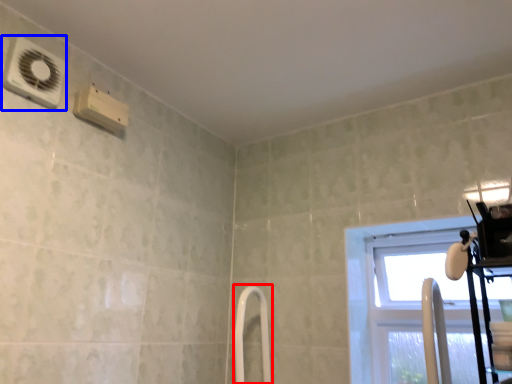
Question: Which of the following is the closest to the observer, shower door (highlighted by a red box) or air conditioning (highlighted by a blue box)?

Choices:
 (A) shower door
 (B) air conditioning

Answer: (B)